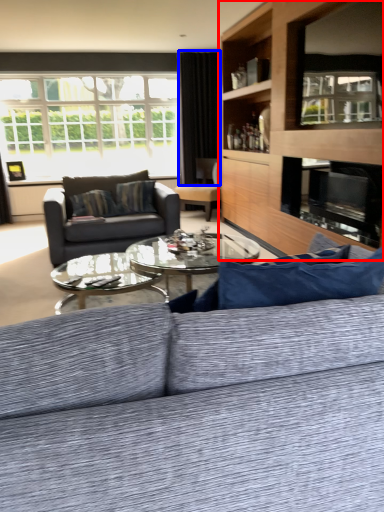
Question: Which of the following is the closest to the observer, entertainment center (highlighted by a red box) or curtain (highlighted by a blue box)?

Choices:
 (A) entertainment center
 (B) curtain

Answer: (A)